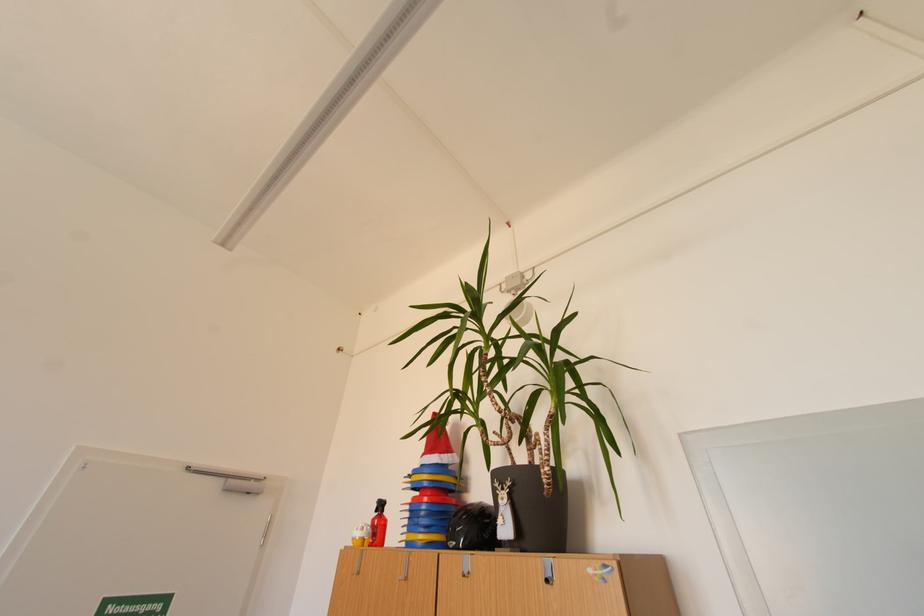
This screenshot has width=924, height=616. What do you see at coordinates (378, 531) in the screenshot?
I see `the red bottle trigger` at bounding box center [378, 531].